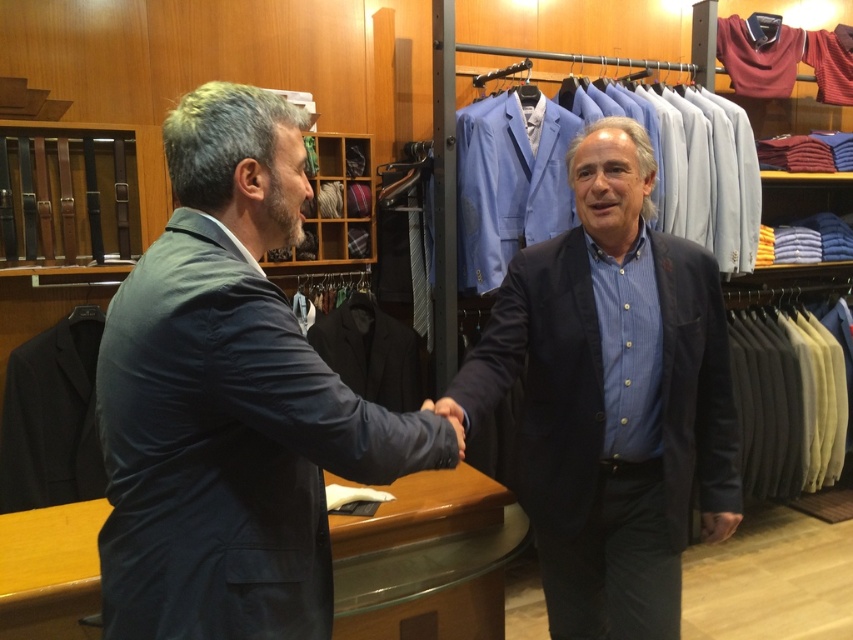
You are standing in the clothing store and want to place a new display between the two points labeled as point (416, 460) and point (461, 454). Which point should the display be closer to in order to be visible to customers entering the store?

The display should be closer to point (416, 460) because it is in front of point (461, 454), making it more visible to customers entering the store.

You are a customer in the store and want to touch the matte black hand at center. However, there is a matte black blazer at center in the way. Can you reach the hand without moving the blazer?

The matte black blazer at center is positioned on the right side of the matte black hand at center. Since the blazer is to the right of the hand, you can reach the hand by moving around the left side of the blazer.

You are a customer in the store and want to grab the dark blue suit at left and the matte black hand at center. Which item can you reach first without moving from your current position?

The dark blue suit at left is closer to the viewer than the matte black hand at center, so you can reach it first.